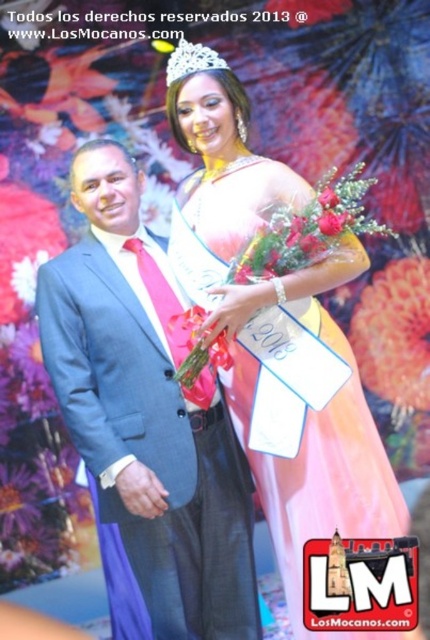
Is blue suit at center taller than clear crystal tiara at upper center?

Indeed, blue suit at center has a greater height compared to clear crystal tiara at upper center.

You are a GUI agent. You are given a task and a screenshot of the screen. Output one action in this format:
    pyautogui.click(x=<x>, y=<y>)
    Task: Click on the blue suit at center
    The height and width of the screenshot is (640, 430).
    Given the screenshot: What is the action you would take?
    pyautogui.click(x=147, y=412)

Is pink satin dress at center smaller than clear crystal tiara at upper center?

Actually, pink satin dress at center might be larger than clear crystal tiara at upper center.

Between point (218, 173) and point (184, 42), which one is positioned in front?

Point (184, 42) is in front.

Does point (371, 449) come in front of point (172, 61)?

Yes, it is.

Locate an element on the screen. pink satin dress at center is located at coordinates (319, 472).

Is point (153, 624) less distant than point (249, 184)?

No, it is not.

Who is more forward, (x=138, y=534) or (x=346, y=532)?

Point (x=346, y=532) is in front.

Identify the location of blue suit at center. The height and width of the screenshot is (640, 430). coord(147,412).